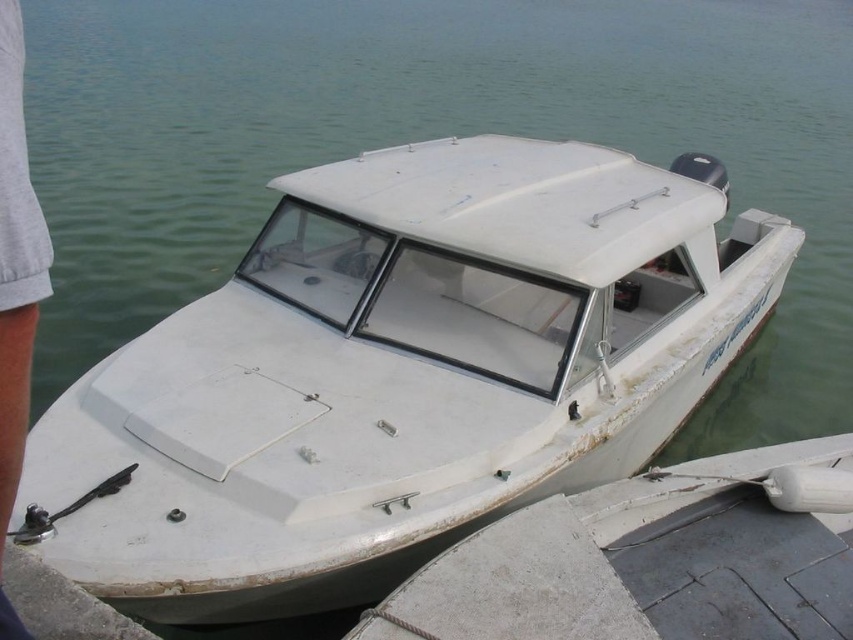
You are standing on the gray concrete dock at lower right and want to move to the gray cotton pants at lower left. Which direction should you go to reach them?

You should move upward to reach the gray cotton pants at lower left because the gray concrete dock at lower right is located below them.

You are standing at the point marked as point (x=404, y=612) and want to board the small white motorboat docked at the concrete pier. The boat is 3 meters long. Can you safely board the boat without overextending from your current position?

The distance between you and the boat is 2.81 meters. Since the boat is 3 meters long, you can safely board it without overextending from your current position as the distance is slightly less than the boat length.